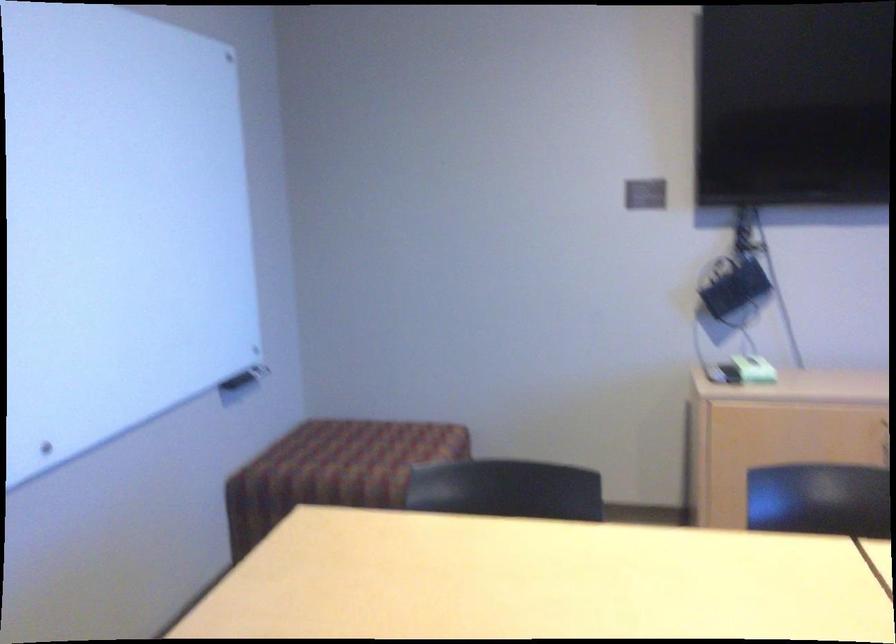
Find where to sit the ottoman sitting surface. Please return your answer as a coordinate pair (x, y).

(331, 465)